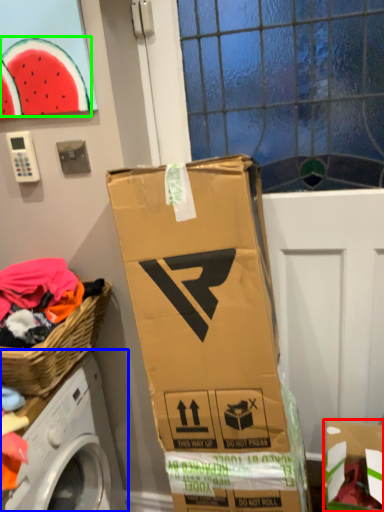
Question: Which object is the closest to the cardboard box (highlighted by a red box)? Choose among these: washing machine (highlighted by a blue box) or watermelon (highlighted by a green box).

Choices:
 (A) washing machine
 (B) watermelon

Answer: (A)